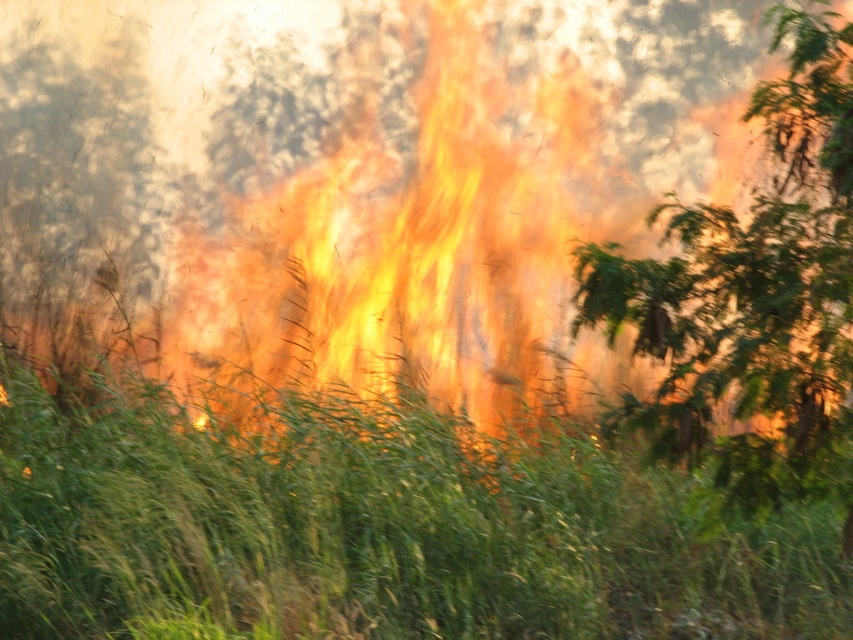
You are a firefighter assessing the distance between the two green leafy trees in the wildfire scene. Given that the recommended safe distance for firebreaks is 15 feet, is the distance between the green leafy tree at center and the green leafy tree at left sufficient to act as a firebreak?

The green leafy tree at center is 14.16 feet from the green leafy tree at left. Since the recommended safe distance for firebreaks is 15 feet, the distance between them is insufficient to act as an effective firebreak.